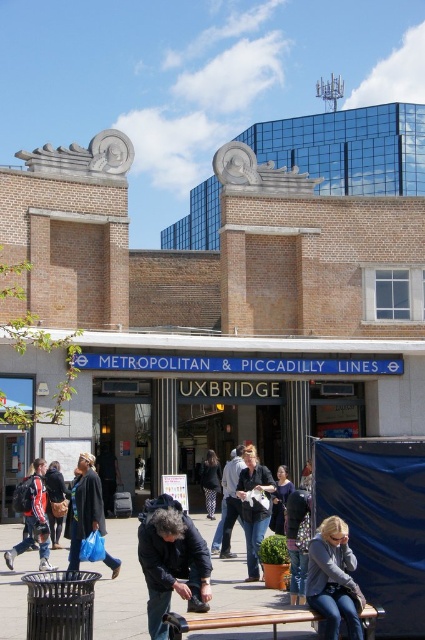
Question: In this image, where is matte black jacket at center located relative to dark blue denim jacket at center?

Choices:
 (A) above
 (B) below

Answer: (A)

Question: Can you confirm if smooth concrete bench at lower center is positioned to the left of dark gray sweater at center?

Choices:
 (A) no
 (B) yes

Answer: (B)

Question: Based on their relative distances, which object is farther from the matte black jacket at center?

Choices:
 (A) smooth concrete bench at lower center
 (B) dark blue denim jacket at center
 (C) red jacket at center
 (D) denim jacket at lower right

Answer: (D)

Question: Which point is closer to the camera?

Choices:
 (A) red jacket at center
 (B) smooth concrete bench at lower center
 (C) dark blue jeans at center

Answer: (B)

Question: Can you confirm if smooth concrete bench at lower center is positioned to the left of dark blue denim jacket at center?

Choices:
 (A) yes
 (B) no

Answer: (A)

Question: Which point is farther to the camera?

Choices:
 (A) (215, 490)
 (B) (61, 500)
 (C) (278, 502)

Answer: (A)